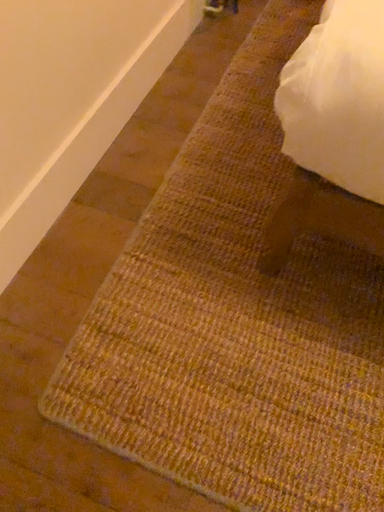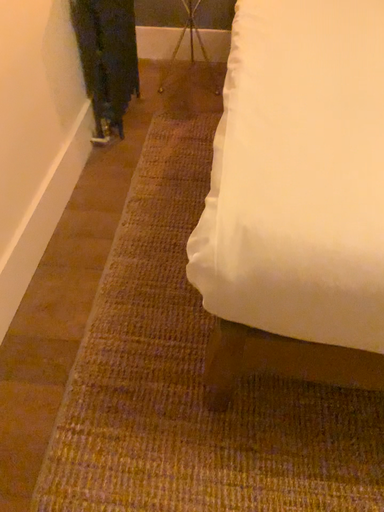
Question: Which way did the camera rotate in the video?

Choices:
 (A) rotated left
 (B) rotated right

Answer: (B)